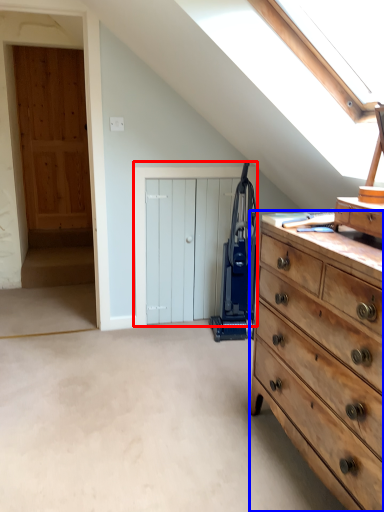
Question: Among these objects, which one is nearest to the camera, door (highlighted by a red box) or chest of drawers (highlighted by a blue box)?

Choices:
 (A) door
 (B) chest of drawers

Answer: (B)